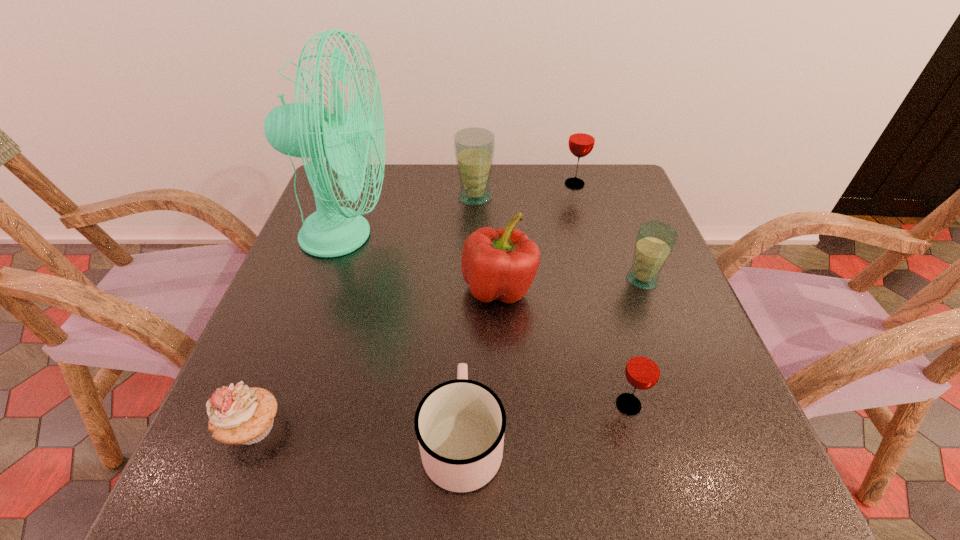
Identify the location of fan. The width and height of the screenshot is (960, 540). (305, 130).

This screenshot has height=540, width=960. In order to click on the tallest object in this screenshot , I will do `click(305, 130)`.

The image size is (960, 540). I want to click on the bigger red glass, so click(581, 142).

Where is `the left blue glass`? This screenshot has height=540, width=960. the left blue glass is located at coordinates coord(474,148).

The width and height of the screenshot is (960, 540). I want to click on the bigger blue glass, so click(x=474, y=148).

Image resolution: width=960 pixels, height=540 pixels. What are the coordinates of `bell pepper` in the screenshot? It's located at (501, 264).

This screenshot has height=540, width=960. Identify the location of the smaller blue glass. (655, 241).

You are a GUI agent. You are given a task and a screenshot of the screen. Output one action in this format:
    pyautogui.click(x=<x>, y=<y>)
    Task: Click on the second nearest glass
    The width and height of the screenshot is (960, 540).
    Given the screenshot: What is the action you would take?
    pyautogui.click(x=655, y=241)

What are the coordinates of `the nearest glass` in the screenshot? It's located at (643, 370).

Where is `the smaller red glass`? the smaller red glass is located at coordinates (643, 370).